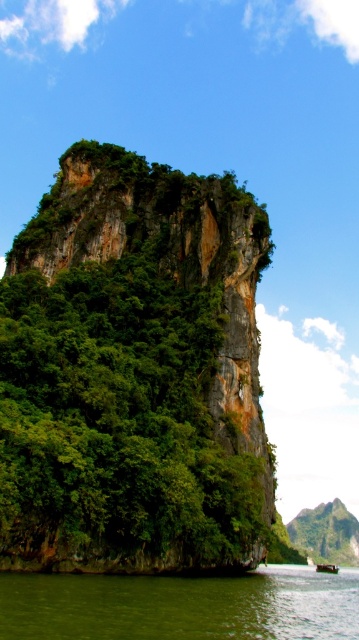
Question: Can you confirm if green liquid water at lower center is positioned above metallic gray boat at center?

Choices:
 (A) yes
 (B) no

Answer: (A)

Question: Which point is closer to the camera?

Choices:
 (A) (75, 616)
 (B) (320, 564)
 (C) (215, 419)

Answer: (A)

Question: Is green rocky cliff at center bigger than green liquid water at lower center?

Choices:
 (A) no
 (B) yes

Answer: (A)

Question: Does green rocky cliff at center lie behind green liquid water at lower center?

Choices:
 (A) no
 (B) yes

Answer: (B)

Question: Which of the following is the farthest from the observer?

Choices:
 (A) (99, 609)
 (B) (131, 381)
 (C) (334, 572)

Answer: (C)

Question: Which point is farther to the camera?

Choices:
 (A) metallic gray boat at center
 (B) green rocky cliff at center

Answer: (A)